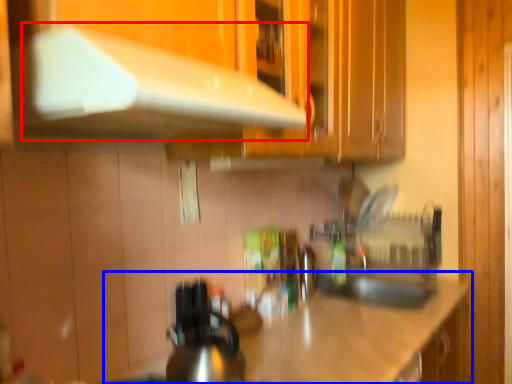
Question: Which of the following is the farthest to the observer, exhaust hood (highlighted by a red box) or countertop (highlighted by a blue box)?

Choices:
 (A) exhaust hood
 (B) countertop

Answer: (B)